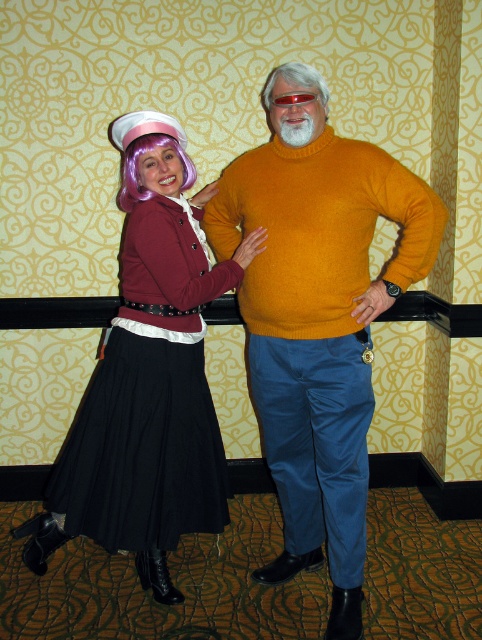
Question: Which point is closer to the camera taking this photo?

Choices:
 (A) 299,92
 (B) 300,284
 (C) 133,156

Answer: (A)

Question: Is matte burgundy cardigan at center-left further to camera compared to red plastic goggles at center?

Choices:
 (A) no
 (B) yes

Answer: (B)

Question: Can you confirm if matte burgundy cardigan at center-left is positioned to the right of purple synthetic wig at upper left?

Choices:
 (A) yes
 (B) no

Answer: (B)

Question: Does mustard yellow turtleneck sweater at center have a smaller size compared to shiny purple wig at center?

Choices:
 (A) yes
 (B) no

Answer: (B)

Question: Which of the following is the farthest from the observer?

Choices:
 (A) (296, 492)
 (B) (184, 244)
 (C) (264, 104)
 (D) (279, 106)

Answer: (C)

Question: Among these points, which one is farthest from the camera?

Choices:
 (A) (331, 378)
 (B) (306, 93)
 (C) (222, 531)

Answer: (C)